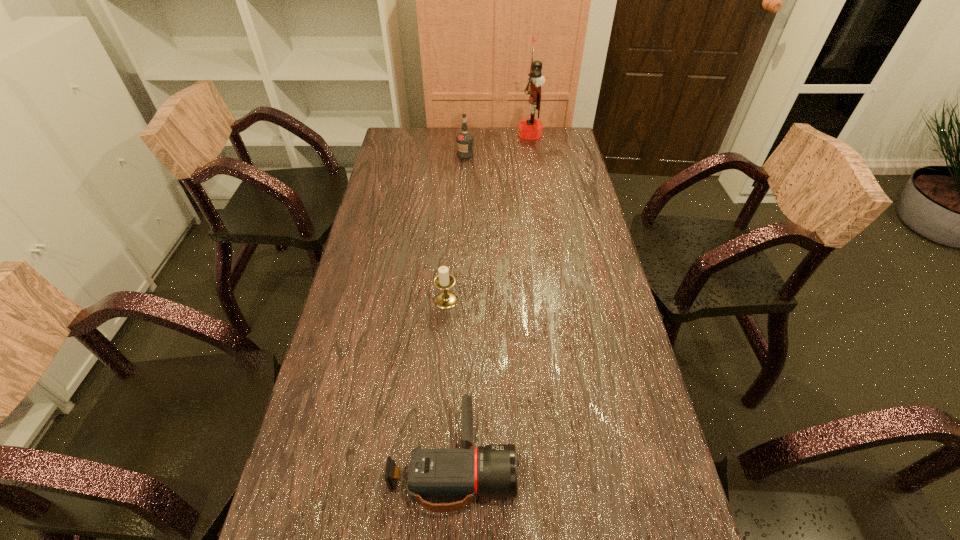
This screenshot has width=960, height=540. Find the location of `vacant space located 0.150m on the front-facing side of the farthest object`. vacant space located 0.150m on the front-facing side of the farthest object is located at coordinates (484, 134).

What are the coordinates of `vacant space located 0.110m on the front label of the vodka` in the screenshot? It's located at (465, 174).

Find the location of a particular element. This screenshot has width=960, height=540. vacant space located on the back of the second shortest object is located at coordinates (450, 241).

I want to click on vacant area situated 0.260m on the lens of the camcorder, so click(634, 461).

Locate an element on the screen. This screenshot has height=540, width=960. nutcracker that is at the far edge is located at coordinates (530, 129).

The height and width of the screenshot is (540, 960). In order to click on vodka present at the far edge in this screenshot , I will do `click(464, 139)`.

Identify the location of object present at the right edge. (530, 129).

Locate an element on the screen. The image size is (960, 540). object that is at the far right corner is located at coordinates (530, 129).

Find the location of a particular element. The image size is (960, 540). blank area at the far edge is located at coordinates (492, 134).

In the image, there is a desktop. At what (x,y) coordinates should I click in order to perform the action: click on vacant space at the left edge. Please return your answer as a coordinate pair (x, y). The image size is (960, 540). Looking at the image, I should click on (350, 364).